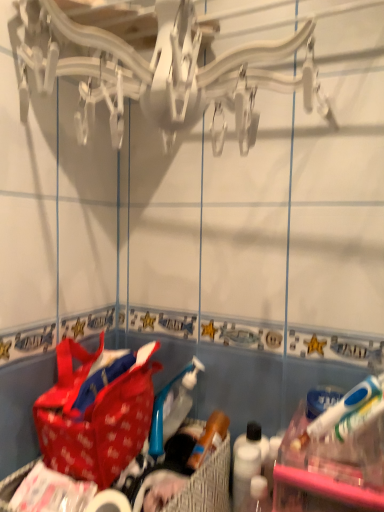
This screenshot has width=384, height=512. I want to click on free space to the back side of white matte toilet paper at lower center, so click(x=143, y=486).